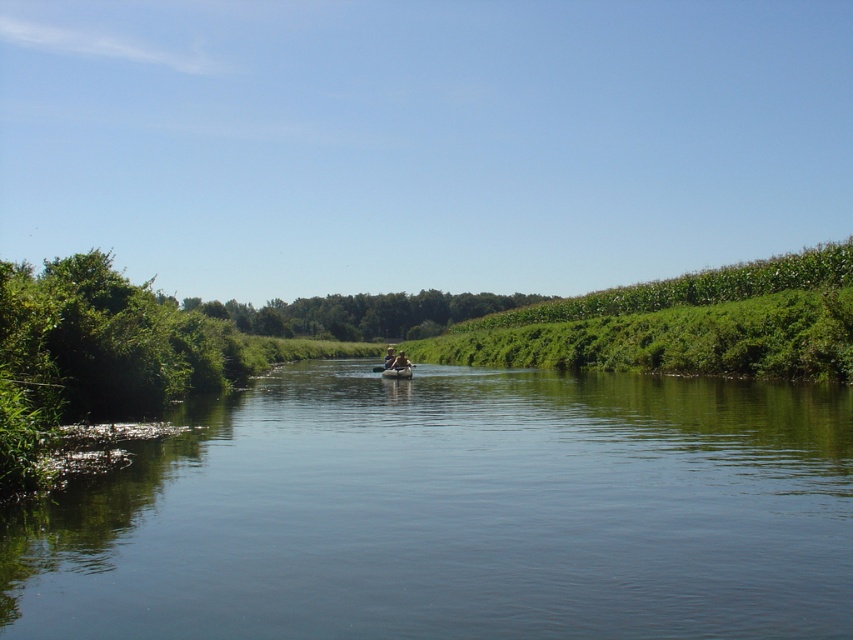
Between green smooth water at center and light brown wooden paddle boat at center, which one appears on the left side from the viewer's perspective?

light brown wooden paddle boat at center

This screenshot has height=640, width=853. Describe the element at coordinates (456, 513) in the screenshot. I see `green smooth water at center` at that location.

What are the coordinates of `green smooth water at center` in the screenshot? It's located at (456, 513).

Is point (416, 444) positioned before point (397, 362)?

Yes, it is in front of point (397, 362).

Can you confirm if green smooth water at center is smaller than smooth tan kayak at center?

No, green smooth water at center is not smaller than smooth tan kayak at center.

The width and height of the screenshot is (853, 640). I want to click on green smooth water at center, so click(x=456, y=513).

Locate an element on the screen. The image size is (853, 640). green smooth water at center is located at coordinates (456, 513).

Looking at this image, which is below, green leafy trees at center or rubber boat at center?

rubber boat at center is lower down.

Does green leafy trees at center lie in front of rubber boat at center?

No, green leafy trees at center is further to the viewer.

Is point (393, 314) farther from viewer compared to point (387, 376)?

Yes, it is behind point (387, 376).

At what (x,y) coordinates should I click in order to perform the action: click on green leafy trees at center. Please return your answer as a coordinate pair (x, y). Looking at the image, I should click on (361, 314).